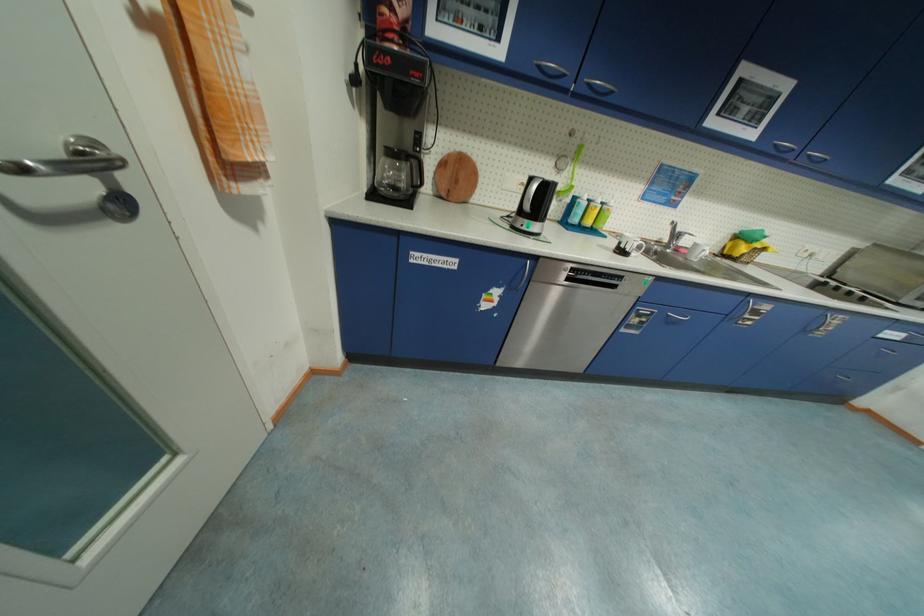
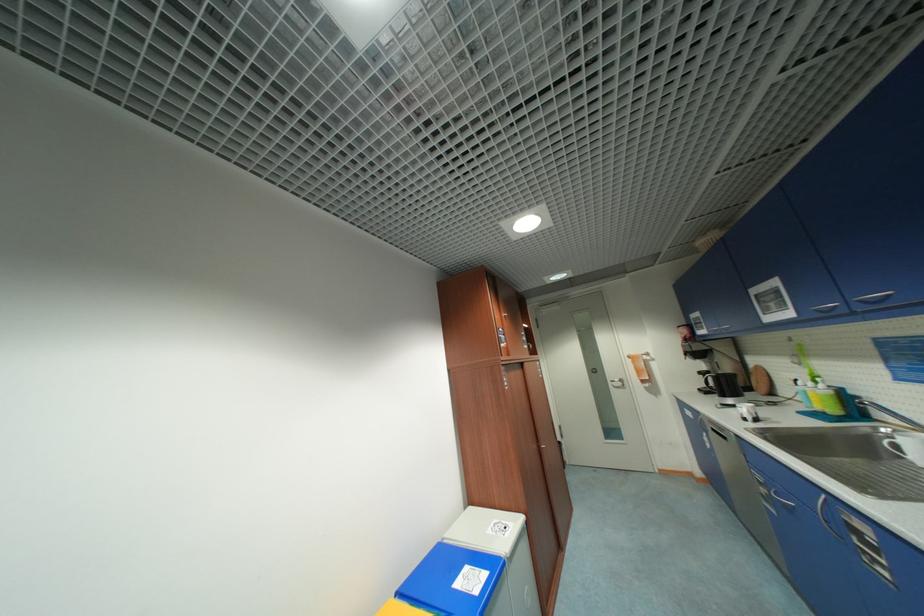
Locate, in the second image, the point that corresponds to (x=642, y=321) in the first image.

(768, 491)